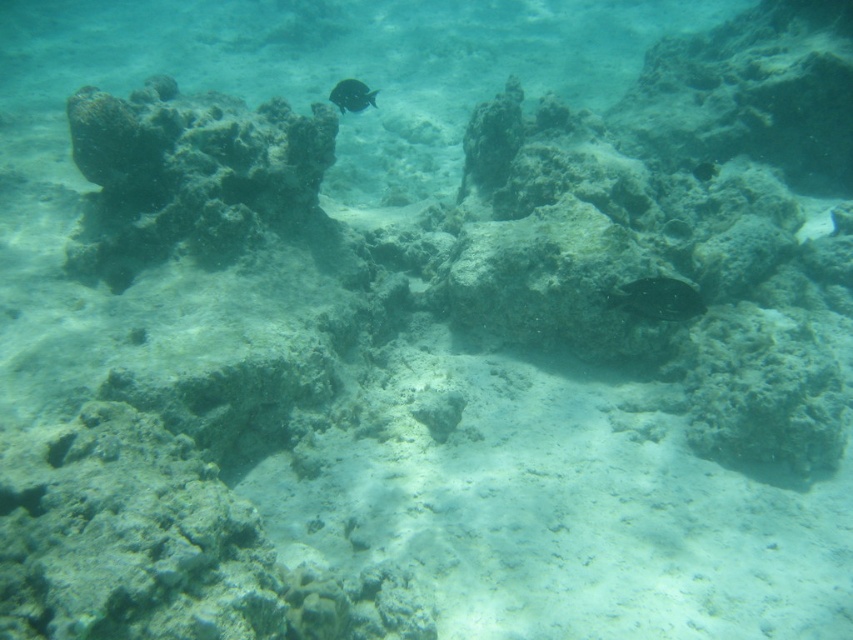
You are a marine biologist observing an underwater scene with a shiny green fish at center and a shiny black fish at center. Which fish is positioned to the right side of the other?

The shiny green fish at center is to the right of the shiny black fish at center.

In the scene shown: You are a marine biologist analyzing an underwater image. You need to locate the dark brown coral at upper left. What are the coordinates of its position in the image?

The dark brown coral at upper left is located at coordinates [189,176].

You are a scuba diver swimming underwater and see two points marked in the image. The first point is at coordinate point (669, 282) and the second is at point (341, 109). If you want to reach the point that is closer to you, which coordinate should you swim towards?

Point (669, 282) is in front of point (341, 109), so the point closer to you is point (669, 282).